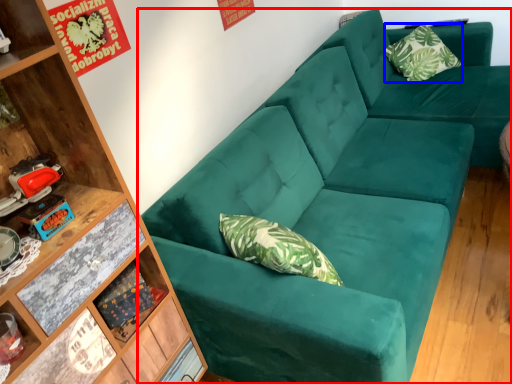
Question: Which object is closer to the camera taking this photo, studio couch (highlighted by a red box) or pillow (highlighted by a blue box)?

Choices:
 (A) studio couch
 (B) pillow

Answer: (A)